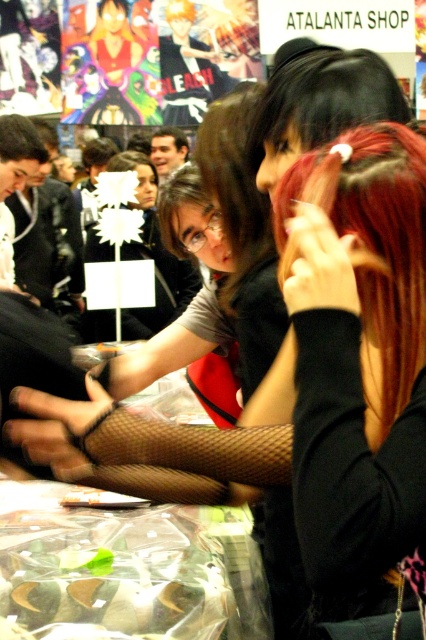
Question: Among these points, which one is farthest from the camera?

Choices:
 (A) (204, 180)
 (B) (132, 435)
 (C) (348, 449)
 (D) (0, 141)

Answer: (D)

Question: Which object is the closest to the fishnet stockings at center?

Choices:
 (A) brownhair at center
 (B) dark brown hair at upper left

Answer: (A)

Question: Considering the relative positions of shiny red hair at center and fishnet stockings at center in the image provided, where is shiny red hair at center located with respect to fishnet stockings at center?

Choices:
 (A) above
 (B) below

Answer: (A)

Question: Among these points, which one is farthest from the camera?

Choices:
 (A) (236, 147)
 (B) (126, 480)
 (C) (365, 376)
 (D) (5, 120)

Answer: (D)

Question: Does shiny red hair at center have a smaller size compared to fishnet stockings at center?

Choices:
 (A) no
 (B) yes

Answer: (A)

Question: Does shiny red hair at center have a smaller size compared to dark brown hair at upper left?

Choices:
 (A) no
 (B) yes

Answer: (A)